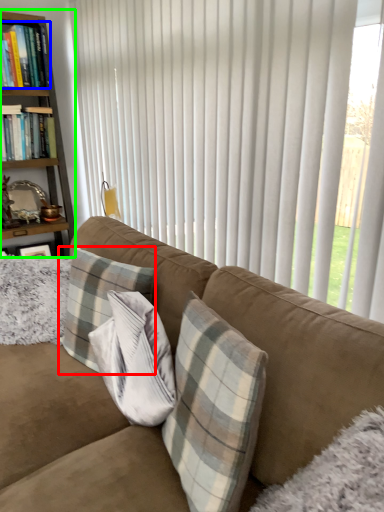
Question: Based on their relative distances, which object is farther from pillow (highlighted by a red box)? Choose from book (highlighted by a blue box) and bookcase (highlighted by a green box).

Choices:
 (A) book
 (B) bookcase

Answer: (A)